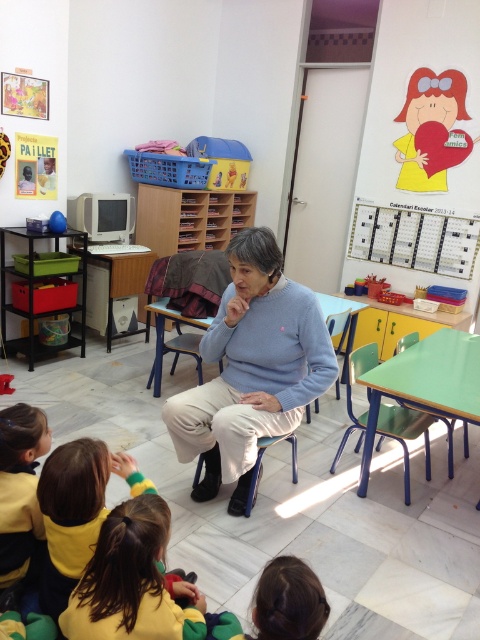
You are a student in the classroom. You need to find the tallest sweater between the light blue sweater at center and the yellow sweater at lower left. Which one should you choose?

The light blue sweater at center is taller than the yellow sweater at lower left, so you should choose the light blue sweater at center.

In the classroom scene, there is a blue metal chair at lower center and a metallic blue chair at lower right. From the perspective of someone standing at the front of the room facing the children, which chair is positioned to the left?

The blue metal chair at lower center is positioned to the left of the metallic blue chair at lower right.